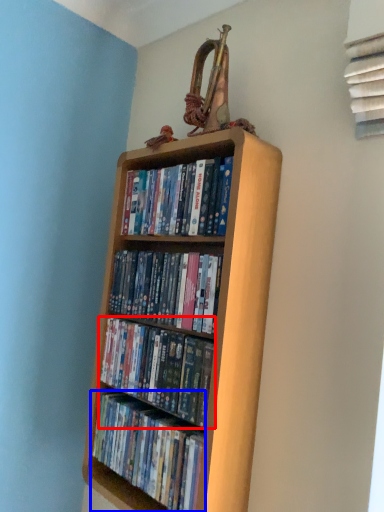
Question: Which of the following is the farthest to the observer, book (highlighted by a red box) or book (highlighted by a blue box)?

Choices:
 (A) book
 (B) book

Answer: (A)